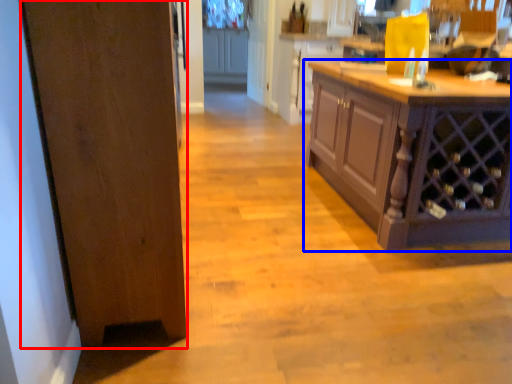
Question: Which point is closer to the camera, door (highlighted by a red box) or cabinetry (highlighted by a blue box)?

Choices:
 (A) door
 (B) cabinetry

Answer: (A)